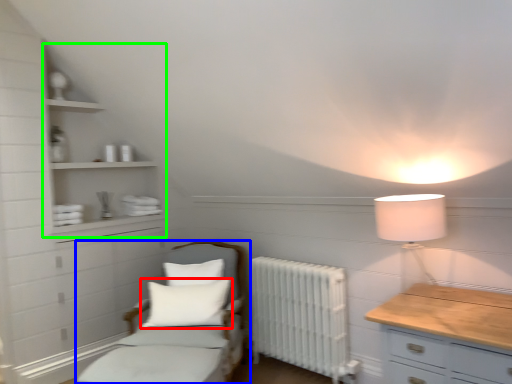
Question: Which object is the farthest from pillow (highlighted by a red box)? Choose among these: furniture (highlighted by a blue box) or cabinet (highlighted by a green box).

Choices:
 (A) furniture
 (B) cabinet

Answer: (B)